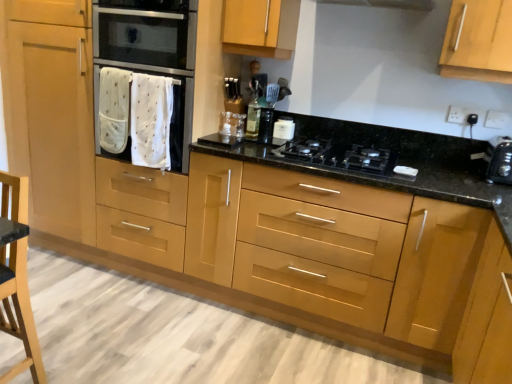
Question: Is stainless steel oven at center far from wooden armchair at lower left?

Choices:
 (A) no
 (B) yes

Answer: (B)

Question: Can you confirm if stainless steel oven at center is taller than wooden armchair at lower left?

Choices:
 (A) no
 (B) yes

Answer: (A)

Question: Is stainless steel oven at center to the left of wooden armchair at lower left from the viewer's perspective?

Choices:
 (A) no
 (B) yes

Answer: (A)

Question: Is stainless steel oven at center surrounding wooden armchair at lower left?

Choices:
 (A) no
 (B) yes

Answer: (A)

Question: Is stainless steel oven at center at the right side of wooden armchair at lower left?

Choices:
 (A) no
 (B) yes

Answer: (B)

Question: Can you confirm if stainless steel oven at center is thinner than wooden armchair at lower left?

Choices:
 (A) yes
 (B) no

Answer: (B)

Question: Can you confirm if glossy wood drawers at center is thinner than translucent glass bottle at center?

Choices:
 (A) yes
 (B) no

Answer: (B)

Question: Is glossy wood drawers at center located outside translucent glass bottle at center?

Choices:
 (A) no
 (B) yes

Answer: (B)

Question: Does glossy wood drawers at center appear on the left side of translucent glass bottle at center?

Choices:
 (A) no
 (B) yes

Answer: (A)

Question: Does glossy wood drawers at center turn towards translucent glass bottle at center?

Choices:
 (A) yes
 (B) no

Answer: (B)

Question: Does glossy wood drawers at center have a greater height compared to translucent glass bottle at center?

Choices:
 (A) yes
 (B) no

Answer: (A)

Question: Is glossy wood drawers at center touching translucent glass bottle at center?

Choices:
 (A) no
 (B) yes

Answer: (A)

Question: Considering the relative positions of white glossy container at upper center and black plastic toaster at right in the image provided, is white glossy container at upper center to the left of black plastic toaster at right from the viewer's perspective?

Choices:
 (A) no
 (B) yes

Answer: (B)